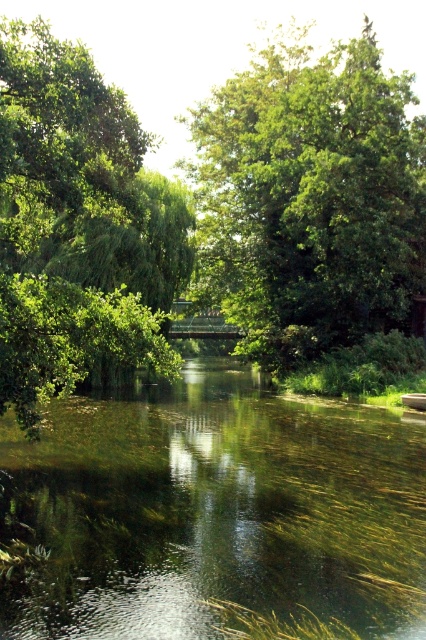
Question: Which is farther from the green grassy lake at center?

Choices:
 (A) green leafy tree at left
 (B) green leafy tree at center

Answer: (B)

Question: Is green leafy tree at center to the right of green leafy tree at left from the viewer's perspective?

Choices:
 (A) yes
 (B) no

Answer: (A)

Question: Which point is closer to the camera?

Choices:
 (A) (164, 413)
 (B) (135, 141)

Answer: (B)

Question: Can you confirm if green grassy lake at center is positioned to the right of green leafy tree at center?

Choices:
 (A) no
 (B) yes

Answer: (A)

Question: Among these points, which one is nearest to the camera?

Choices:
 (A) (210, 188)
 (B) (247, 524)
 (C) (28, 93)

Answer: (B)

Question: Is green leafy tree at center above green leafy tree at left?

Choices:
 (A) no
 (B) yes

Answer: (B)